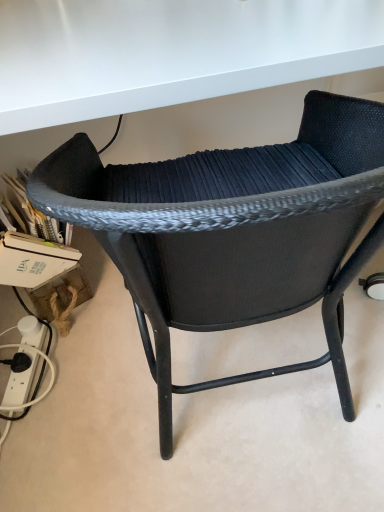
This screenshot has height=512, width=384. Identify the location of vacant region below black woven chair at center (from a real-world perspective). (243, 399).